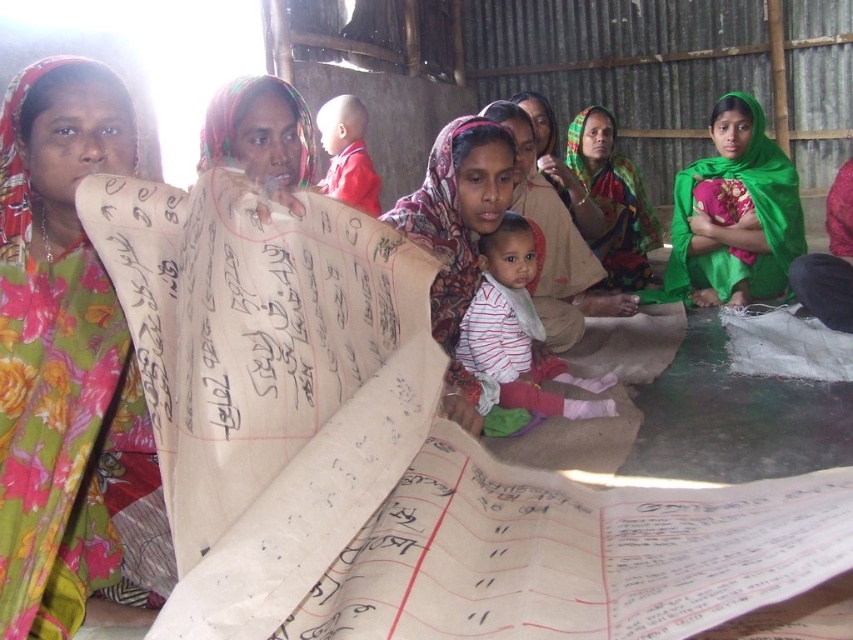
You are an anthropologist observing the scene. You notice the beige paper scroll at center and the striped fabric baby at center. Which object is wider in this context?

The beige paper scroll at center might be wider than striped fabric baby at center.

You are a photographer standing 2 meters away from the beige paper scroll at center and the striped fabric baby at center. You want to capture both objects in a single frame without moving your position. Is there enough space between them to fit both in your camera view that has a 1.6 meter width? Please explain.

The distance between the beige paper scroll at center and the striped fabric baby at center is 1.59 meters. Since your camera view can accommodate 1.6 meters width, which is slightly larger than the 1.59 meters separating them, both objects can fit within the frame without moving your position.

You are a photographer trying to capture the floral fabric scarf at upper left in the center of your frame. Given its current position at point coordinates, can you determine if it will be centered in your shot?

The floral fabric scarf at upper left is located at point coordinates, so it will not be centered in your shot.